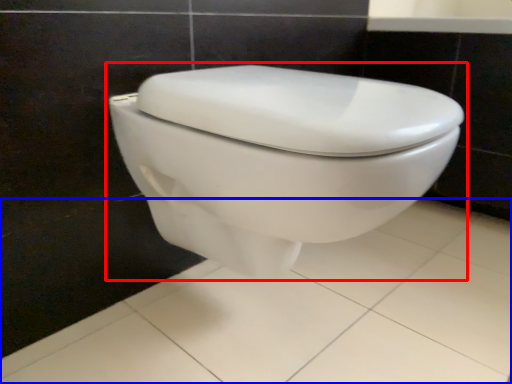
Question: Which point is closer to the camera, toilet (highlighted by a red box) or porcelain (highlighted by a blue box)?

Choices:
 (A) toilet
 (B) porcelain

Answer: (B)